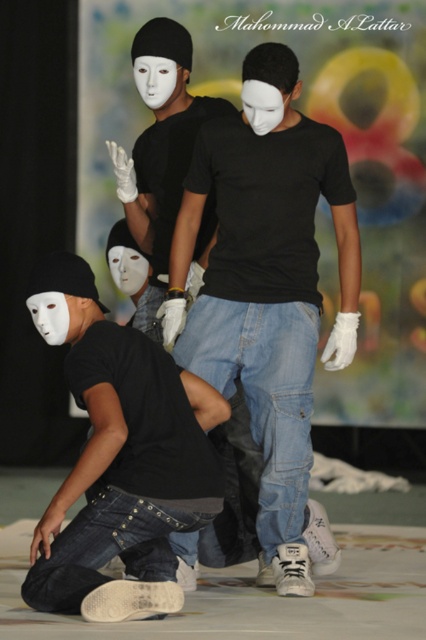
You are a photographer trying to capture a group photo of the matte black shirt at center and the matte black shirt at lower left. Since you want to ensure both are visible, which one should you position closer to the camera to avoid overlap?

You should position the matte black shirt at lower left closer to the camera because it is to the left of the matte black shirt at center, so moving it forward will prevent overlap.